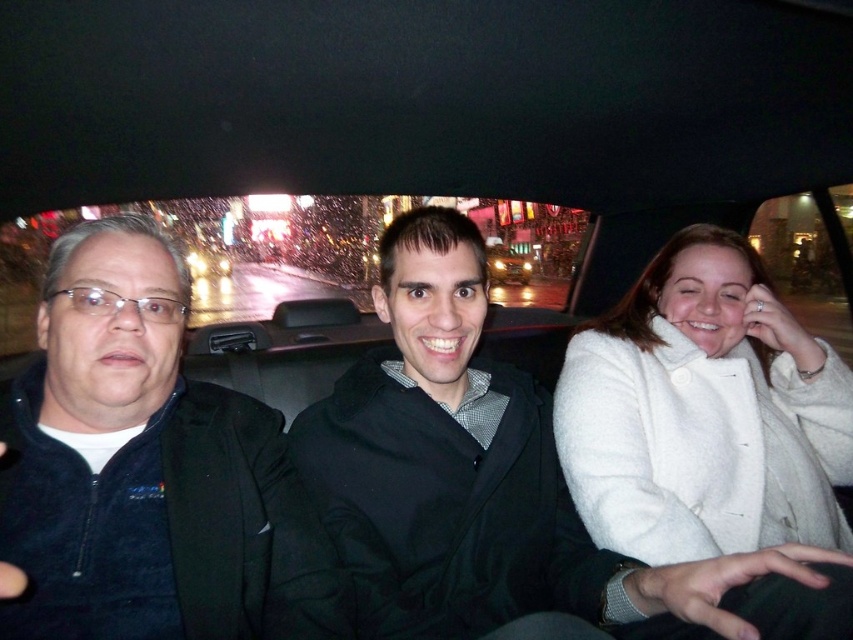
Is point (21, 504) behind point (587, 460)?

No, it is in front of (587, 460).

Between dark blue fleece jacket at left and white wool coat at right, which one appears on the left side from the viewer's perspective?

dark blue fleece jacket at left is more to the left.

Find the location of a particular element. dark blue fleece jacket at left is located at coordinates (148, 468).

Who is positioned more to the left, matte black jacket at center or dark blue fleece jacket at left?

From the viewer's perspective, dark blue fleece jacket at left appears more on the left side.

Does point (421, 230) come in front of point (91, 545)?

No, it is behind (91, 545).

The image size is (853, 640). In order to click on matte black jacket at center in this screenshot , I will do `click(502, 486)`.

Does matte black jacket at center have a larger size compared to white wool coat at right?

Indeed, matte black jacket at center has a larger size compared to white wool coat at right.

Does matte black jacket at center lie behind white wool coat at right?

No.

The height and width of the screenshot is (640, 853). Describe the element at coordinates (502, 486) in the screenshot. I see `matte black jacket at center` at that location.

This screenshot has height=640, width=853. In order to click on matte black jacket at center in this screenshot , I will do point(502,486).